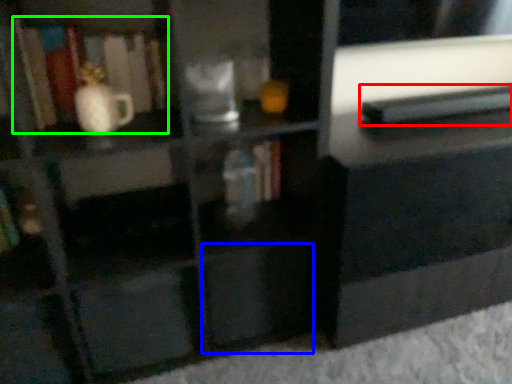
Question: Which object is positioned closest to book (highlighted by a red box)? Select from drawer (highlighted by a blue box) and book (highlighted by a green box).

Choices:
 (A) drawer
 (B) book

Answer: (A)